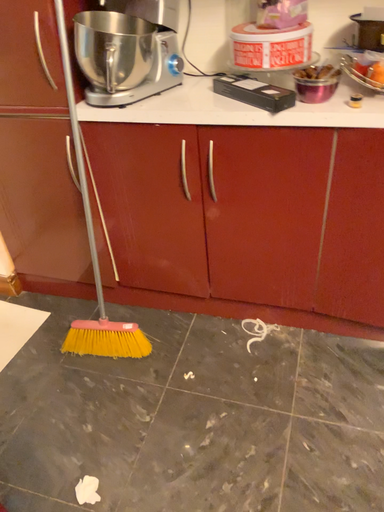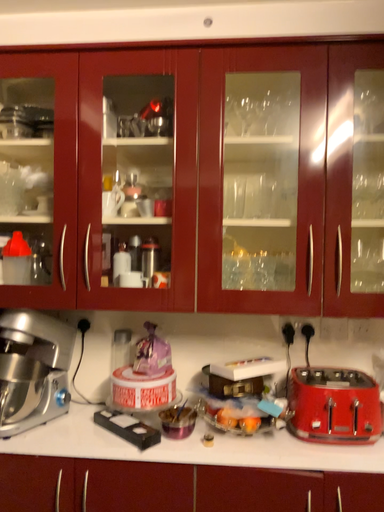
Question: How did the camera likely rotate when shooting the video?

Choices:
 (A) rotated right
 (B) rotated left

Answer: (A)